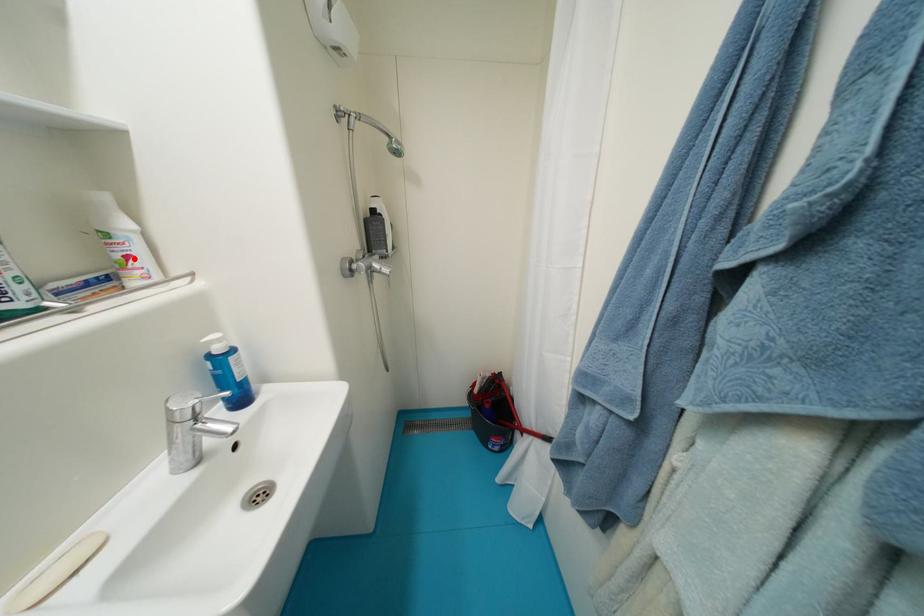
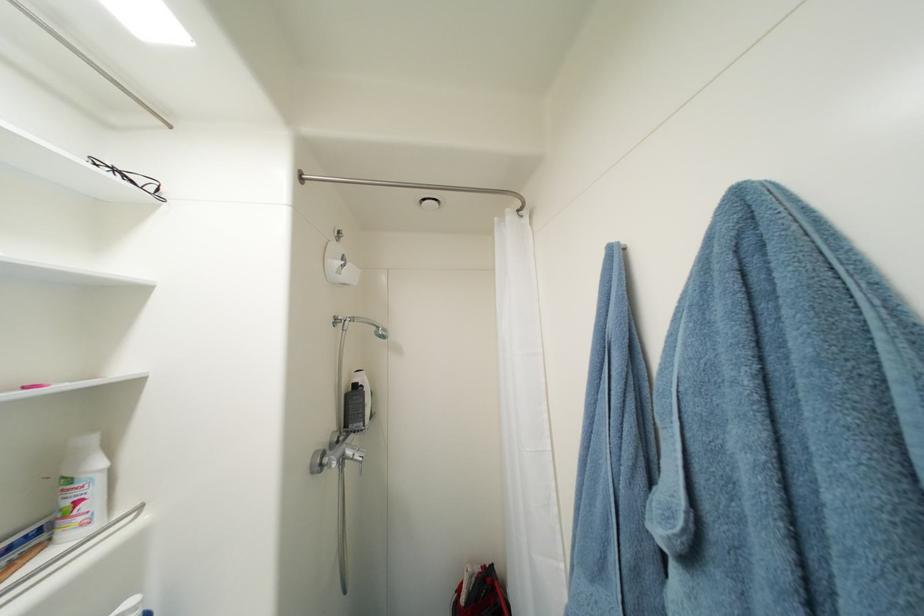
Find the pixel in the second image that matches the highlighted location in the first image.

(84, 504)